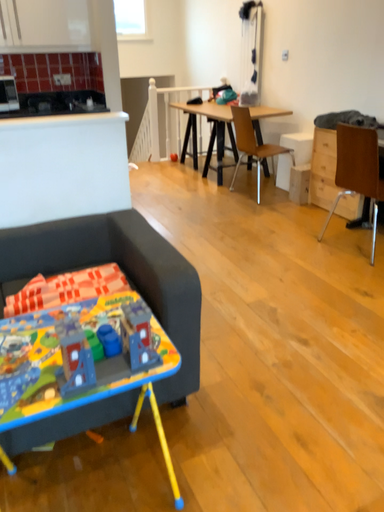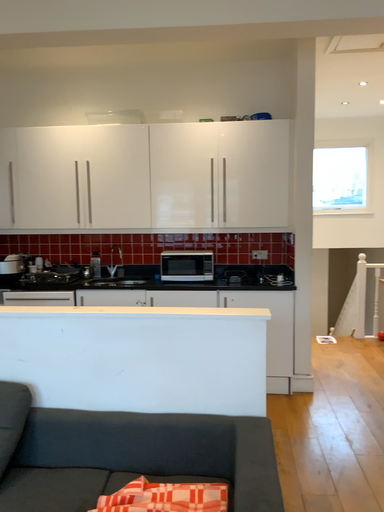
Question: Which way did the camera rotate in the video?

Choices:
 (A) rotated left
 (B) rotated right

Answer: (A)